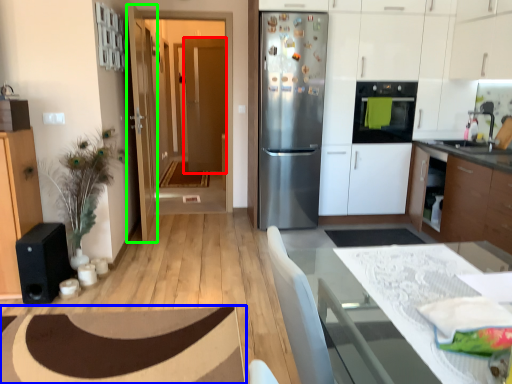
Question: Based on their relative distances, which object is farther from door (highlighted by a red box)? Choose from plain (highlighted by a blue box) and door (highlighted by a green box).

Choices:
 (A) plain
 (B) door

Answer: (A)